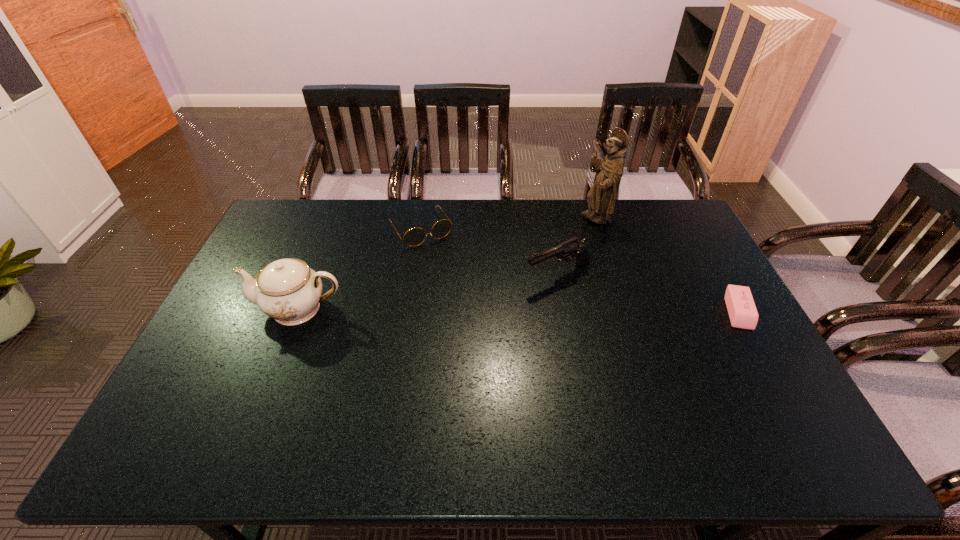
Find the location of a particular element. This screenshot has height=540, width=960. vacant position located 0.340m at the end of the barrel of the third object from right to left is located at coordinates pyautogui.click(x=434, y=325).

Identify the location of free space located at the end of the barrel of the third object from right to left. (462, 313).

I want to click on sunglasses that is at the far edge, so click(413, 237).

Where is `figurine present at the far edge`? The width and height of the screenshot is (960, 540). figurine present at the far edge is located at coordinates tap(601, 197).

The height and width of the screenshot is (540, 960). What are the coordinates of `object located at the left edge` in the screenshot? It's located at (287, 290).

Identify the location of object located at the right edge. (742, 311).

Locate an element on the screen. This screenshot has height=540, width=960. vacant space at the far edge is located at coordinates (540, 229).

At what (x,y) coordinates should I click in order to perform the action: click on vacant region at the near edge of the desktop. Please return your answer as a coordinate pair (x, y). Looking at the image, I should click on (468, 402).

This screenshot has width=960, height=540. Identify the location of vacant space at the left edge of the desktop. (215, 341).

Where is `vacant space at the right edge of the desktop`? The height and width of the screenshot is (540, 960). vacant space at the right edge of the desktop is located at coordinates [732, 328].